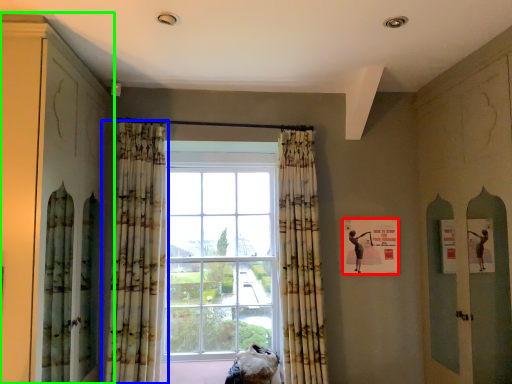
Question: Which object is the farthest from poster (highlighted by a red box)? Choose among these: curtain (highlighted by a blue box) or cabinetry (highlighted by a green box).

Choices:
 (A) curtain
 (B) cabinetry

Answer: (B)